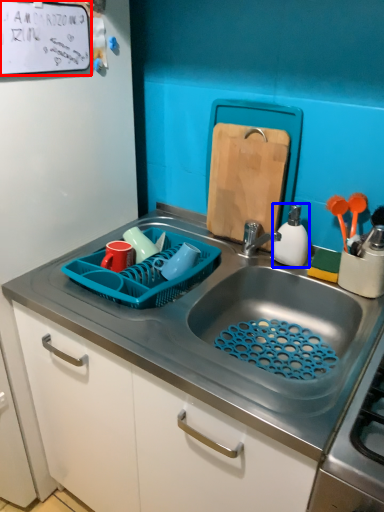
Question: Among these objects, which one is nearest to the camera, bulletin board (highlighted by a red box) or appliance (highlighted by a blue box)?

Choices:
 (A) bulletin board
 (B) appliance

Answer: (A)